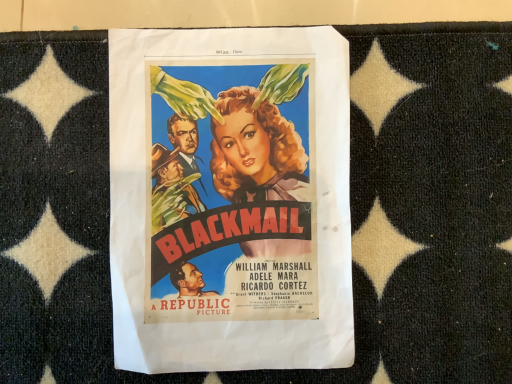
Where is `free space above matte paper poster at center (from a real-world perspective)`? free space above matte paper poster at center (from a real-world perspective) is located at coordinates (228, 189).